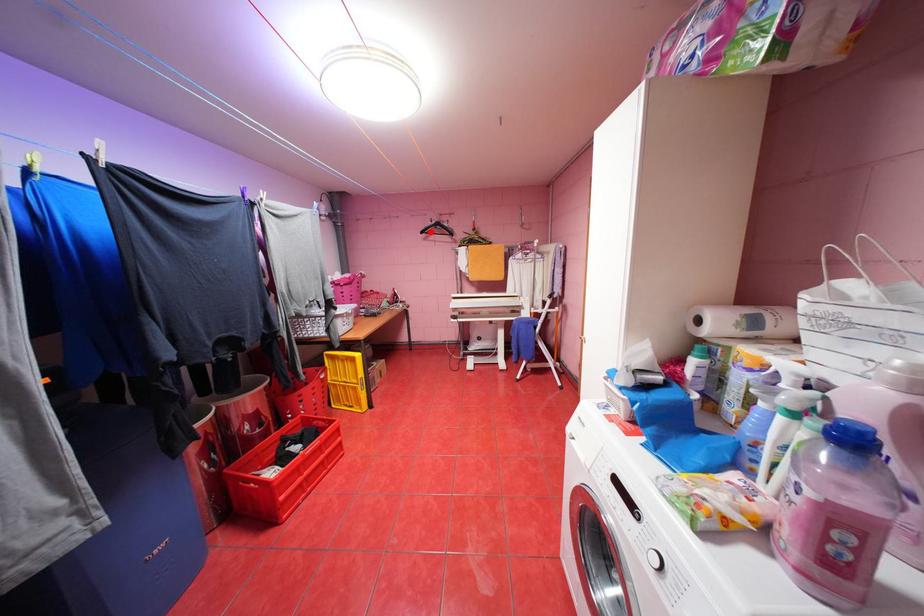
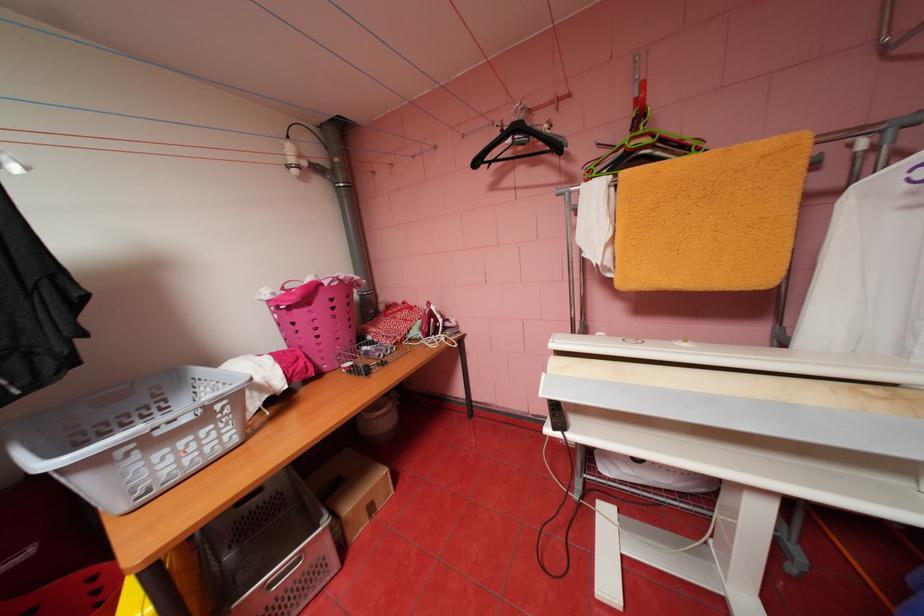
Locate, in the second image, the point that corresponds to the highlighted location in the first image.

(484, 163)